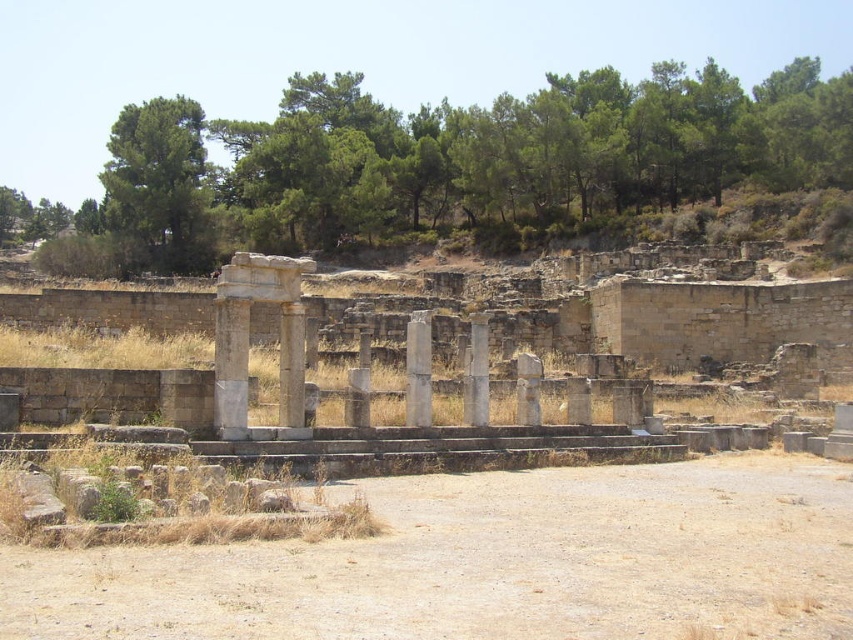
You are an archaeologist examining the site. You notice the green leafy tree at upper left and the gray stone pillar at center. Which object would cast a longer shadow at noon due to its size?

The green leafy tree at upper left is larger in size than the gray stone pillar at center, so it would cast a longer shadow at noon.

From the picture: You are an archaeologist examining the site and need to determine which object is taller between the green leafy tree at upper left and the gray stone pillar at center. Based on the scene, which one is taller?

The green leafy tree at upper left is taller than the gray stone pillar at center.